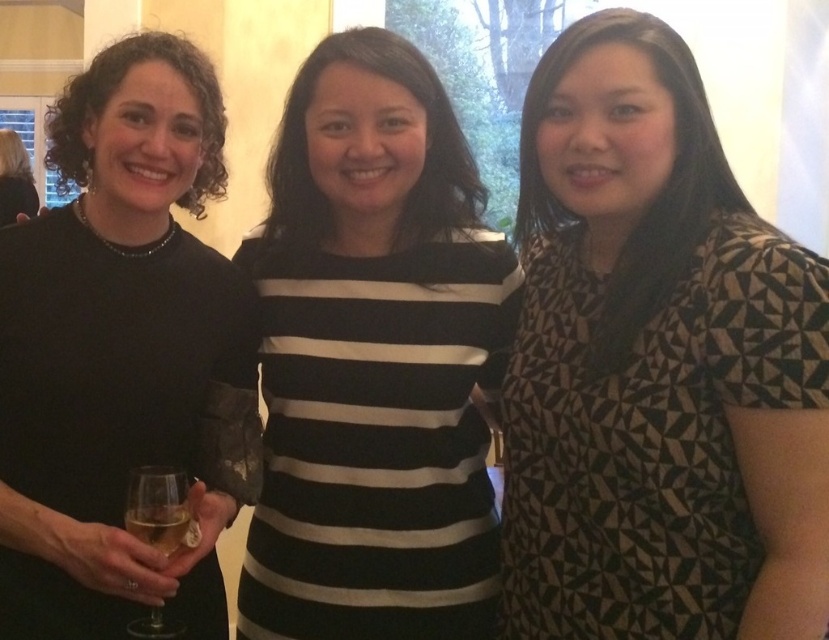
Who is higher up, black geometric-patterned dress at center or black striped shirt at center?

black geometric-patterned dress at center is higher up.

Between black geometric-patterned dress at center and black striped shirt at center, which one appears on the right side from the viewer's perspective?

black geometric-patterned dress at center is more to the right.

At what (x,y) coordinates should I click in order to perform the action: click on black geometric-patterned dress at center. Please return your answer as a coordinate pair (x, y). This screenshot has width=829, height=640. Looking at the image, I should click on (657, 365).

Does black geometric-patterned dress at center have a lesser height compared to clear glass at lower left?

No, black geometric-patterned dress at center is not shorter than clear glass at lower left.

Which of these two, black geometric-patterned dress at center or clear glass at lower left, stands shorter?

With less height is clear glass at lower left.

What do you see at coordinates (657, 365) in the screenshot? This screenshot has height=640, width=829. I see `black geometric-patterned dress at center` at bounding box center [657, 365].

Image resolution: width=829 pixels, height=640 pixels. Identify the location of black geometric-patterned dress at center. (657, 365).

Describe the element at coordinates (657, 365) in the screenshot. I see `black geometric-patterned dress at center` at that location.

Does point (599, 472) come in front of point (3, 134)?

That is True.

At what (x,y) coordinates should I click in order to perform the action: click on black geometric-patterned dress at center. Please return your answer as a coordinate pair (x, y). This screenshot has height=640, width=829. Looking at the image, I should click on (657, 365).